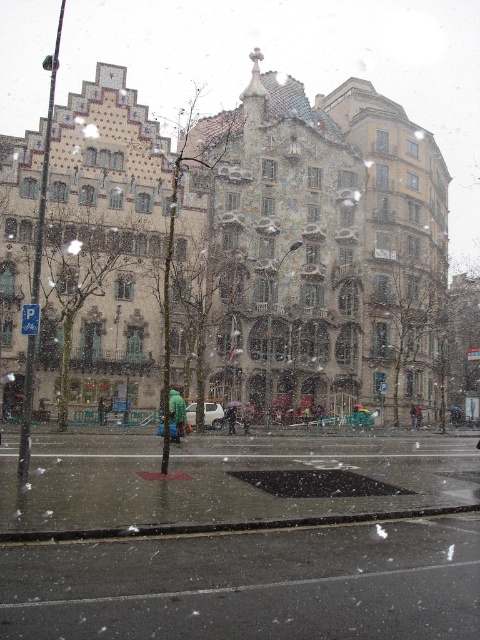
Between green fuzzy coat at center and transparent plastic umbrella at center, which one has more height?

green fuzzy coat at center

Which is behind, point (179, 406) or point (238, 404)?

The point (238, 404) is behind.

Which is in front, point (183, 419) or point (235, 404)?

Point (183, 419) is in front.

Locate an element on the screen. This screenshot has height=640, width=480. green fuzzy coat at center is located at coordinates (177, 412).